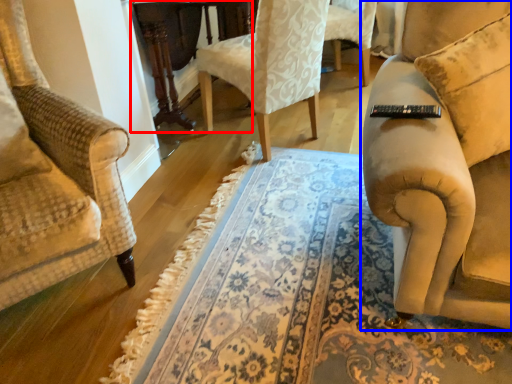
Question: Which object is closer to the camera taking this photo, round table (highlighted by a red box) or studio couch (highlighted by a blue box)?

Choices:
 (A) round table
 (B) studio couch

Answer: (B)